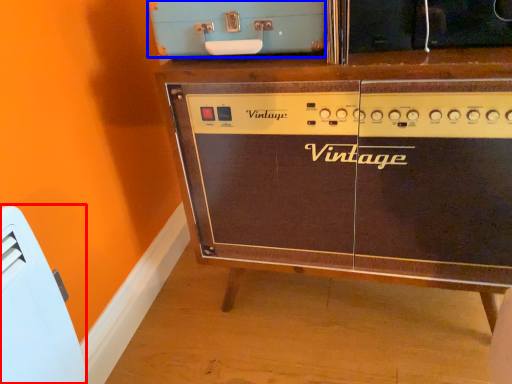
Question: Which of the following is the closest to the observer, appliance (highlighted by a red box) or appliance (highlighted by a blue box)?

Choices:
 (A) appliance
 (B) appliance

Answer: (A)